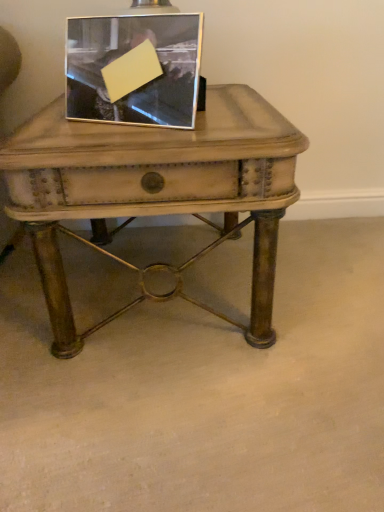
Question: Is matte wood table at center spatially inside metallic silver picture frame at upper center, or outside of it?

Choices:
 (A) outside
 (B) inside

Answer: (A)

Question: From a real-world perspective, is matte wood table at center physically located above or below metallic silver picture frame at upper center?

Choices:
 (A) below
 (B) above

Answer: (A)

Question: Does point (271, 266) appear closer or farther from the camera than point (135, 40)?

Choices:
 (A) closer
 (B) farther

Answer: (B)

Question: From the image's perspective, relative to matte wood table at center, is metallic silver picture frame at upper center above or below?

Choices:
 (A) above
 (B) below

Answer: (A)

Question: In the image, is metallic silver picture frame at upper center on the left side or the right side of matte wood table at center?

Choices:
 (A) right
 (B) left

Answer: (B)

Question: Is metallic silver picture frame at upper center spatially inside matte wood table at center, or outside of it?

Choices:
 (A) inside
 (B) outside

Answer: (B)

Question: From their relative heights in the image, would you say metallic silver picture frame at upper center is taller or shorter than matte wood table at center?

Choices:
 (A) tall
 (B) short

Answer: (B)